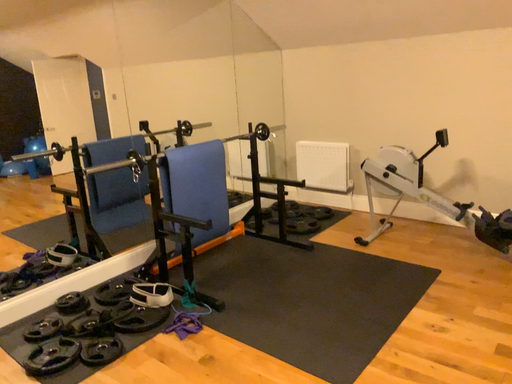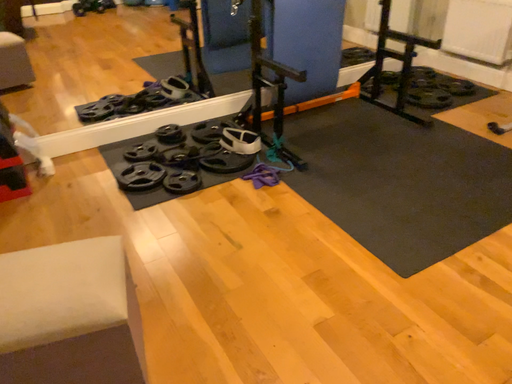
Question: How did the camera likely rotate when shooting the video?

Choices:
 (A) rotated right
 (B) rotated left

Answer: (B)